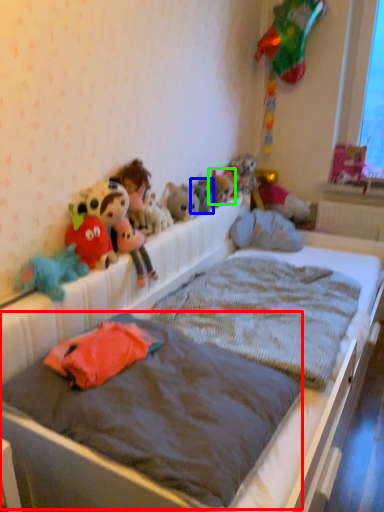
Question: Considering the real-world distances, which object is farthest from mattress (highlighted by a red box)? toy (highlighted by a blue box) or toy (highlighted by a green box)?

Choices:
 (A) toy
 (B) toy

Answer: (B)